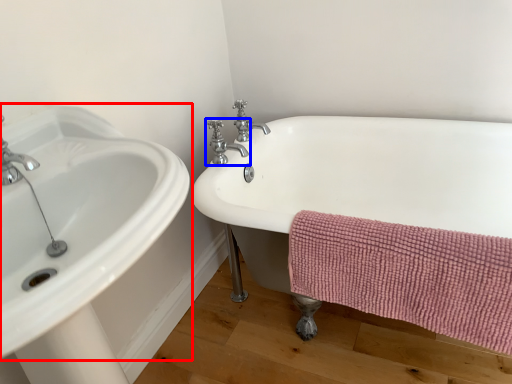
Question: Which object appears farthest to the camera in this image, sink (highlighted by a red box) or tap (highlighted by a blue box)?

Choices:
 (A) sink
 (B) tap

Answer: (B)